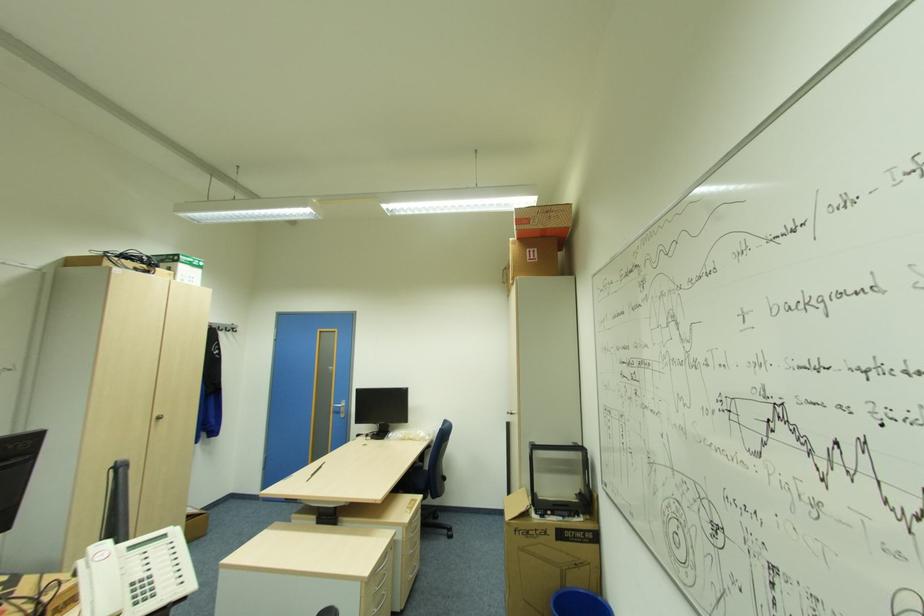
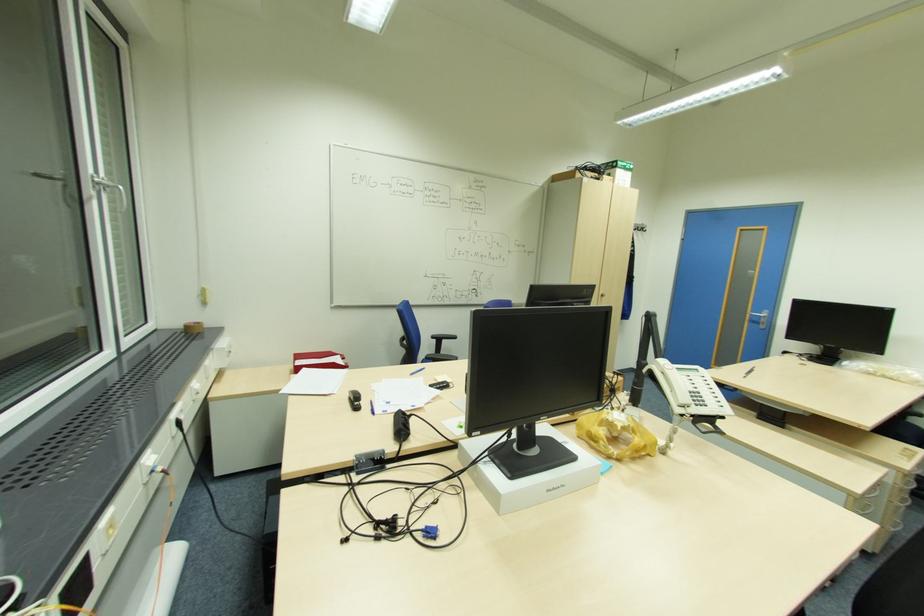
The point at (x=408, y=527) is marked in the first image. Where is the corresponding point in the second image?

(907, 474)